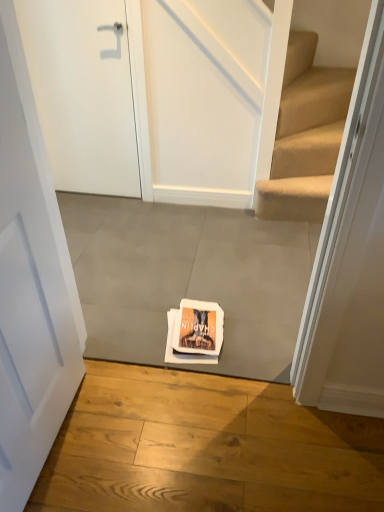
Question: Can you confirm if white matte door at center, which appears as the first door when ordered from the bottom, is taller than gray concrete at center, the second concrete when ordered from back to front?

Choices:
 (A) no
 (B) yes

Answer: (B)

Question: Is white matte door at center, which is counted as the first door, starting from the front, in contact with gray concrete at center, the second concrete from the top?

Choices:
 (A) yes
 (B) no

Answer: (B)

Question: From a real-world perspective, is white matte door at center, the second door viewed from the top, located beneath gray concrete at center, the second concrete from the top?

Choices:
 (A) yes
 (B) no

Answer: (B)

Question: Does white matte door at center, the second door viewed from the top, contain gray concrete at center, the second concrete when ordered from back to front?

Choices:
 (A) no
 (B) yes

Answer: (A)

Question: Can you confirm if white matte door at center, acting as the 2th door starting from the back, is wider than gray concrete at center, marked as the 1th concrete in a front-to-back arrangement?

Choices:
 (A) yes
 (B) no

Answer: (B)

Question: Considering the positions of gray concrete at center, the 2th concrete in the bottom-to-top sequence, and white matte door at center, which is counted as the first door, starting from the front, in the image, is gray concrete at center, the 2th concrete in the bottom-to-top sequence, wider or thinner than white matte door at center, which is counted as the first door, starting from the front,?

Choices:
 (A) thin
 (B) wide

Answer: (B)

Question: In terms of height, does gray concrete at center, which ranks as the second concrete in front-to-back order, look taller or shorter compared to white matte door at center, acting as the 2th door starting from the back?

Choices:
 (A) short
 (B) tall

Answer: (A)

Question: From the image's perspective, is gray concrete at center, the first concrete in the top-to-bottom sequence, above or below white matte door at center, acting as the 2th door starting from the back?

Choices:
 (A) above
 (B) below

Answer: (A)

Question: Do you think gray concrete at center, which ranks as the second concrete in front-to-back order, is within white matte door at center, which is counted as the first door, starting from the front, or outside of it?

Choices:
 (A) inside
 (B) outside

Answer: (B)

Question: Is gray concrete at center, acting as the 1th concrete starting from the back, spatially inside gray concrete at center, acting as the first concrete starting from the bottom, or outside of it?

Choices:
 (A) inside
 (B) outside

Answer: (B)

Question: Looking at their shapes, would you say gray concrete at center, which ranks as the second concrete in front-to-back order, is wider or thinner than gray concrete at center, acting as the first concrete starting from the bottom?

Choices:
 (A) wide
 (B) thin

Answer: (A)

Question: Does point (233, 330) appear closer or farther from the camera than point (251, 474)?

Choices:
 (A) closer
 (B) farther

Answer: (B)

Question: Considering the positions of gray concrete at center, the first concrete in the top-to-bottom sequence, and gray concrete at center, the second concrete when ordered from back to front, in the image, is gray concrete at center, the first concrete in the top-to-bottom sequence, bigger or smaller than gray concrete at center, the second concrete when ordered from back to front,?

Choices:
 (A) big
 (B) small

Answer: (A)

Question: Is gray concrete at center, the second concrete from the top, bigger or smaller than white matte door at center, acting as the 2th door starting from the back?

Choices:
 (A) big
 (B) small

Answer: (B)

Question: Is point [x=246, y=483] positioned closer to the camera than point [x=79, y=359]?

Choices:
 (A) closer
 (B) farther

Answer: (A)